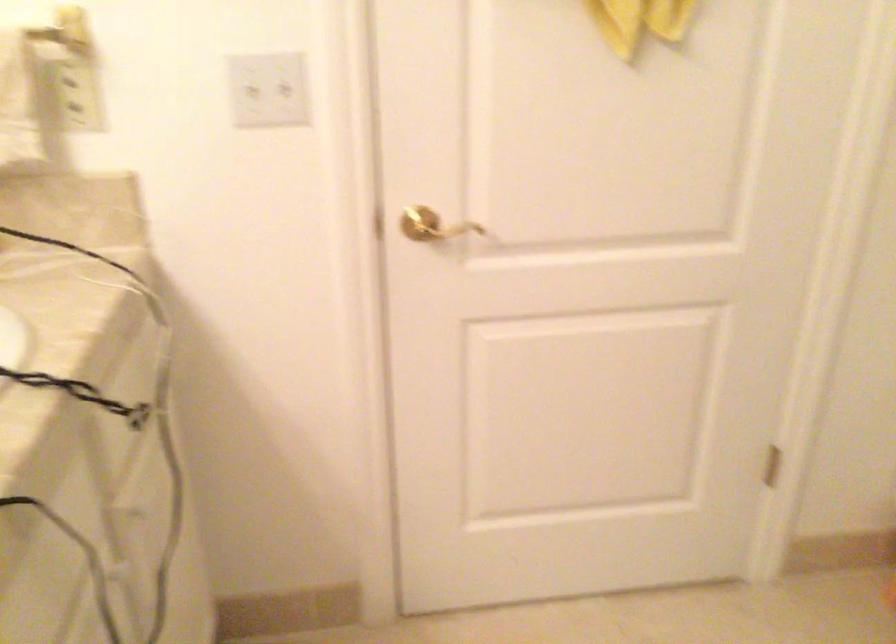
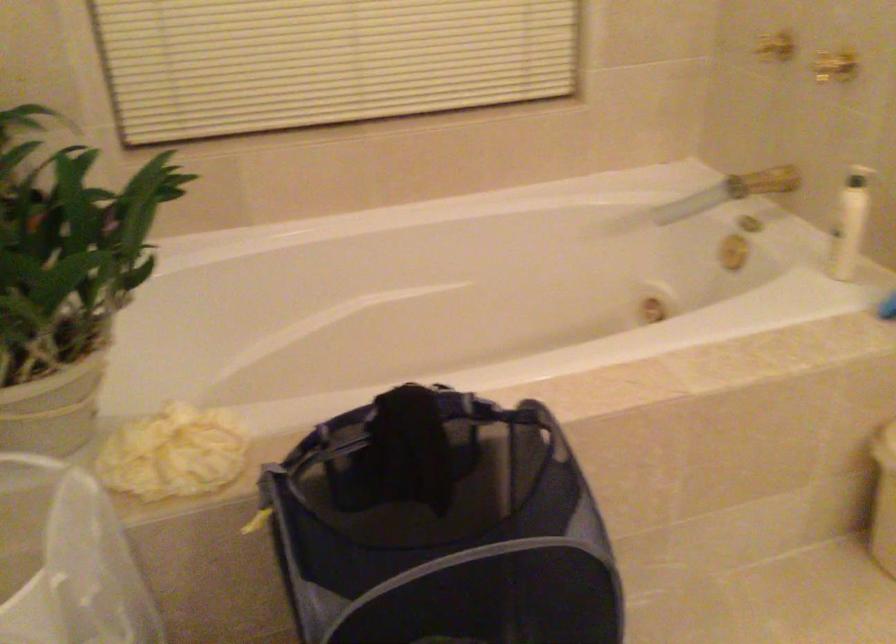
The first image is from the beginning of the video and the second image is from the end. How did the camera likely rotate when shooting the video?

The rotation direction of the camera is right-down.